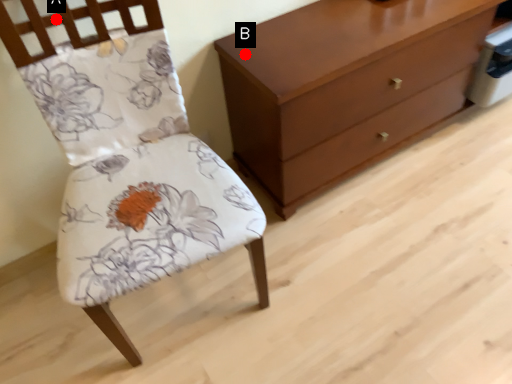
Question: Two points are circled on the image, labeled by A and B beside each circle. Which point is further to the camera?

Choices:
 (A) A is further
 (B) B is further

Answer: (B)